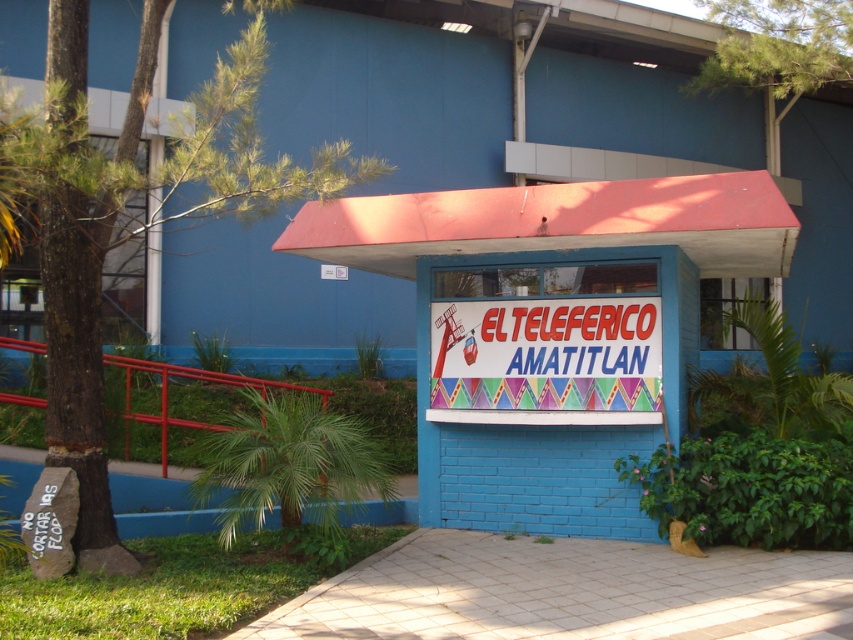
Question: Where is blue painted brick sign at center located in relation to colorful plastic sign at center in the image?

Choices:
 (A) below
 (B) above

Answer: (B)

Question: Which of the following is the closest to the observer?

Choices:
 (A) blue painted brick sign at center
 (B) colorful plastic sign at center

Answer: (A)

Question: Does blue painted brick sign at center appear under colorful plastic sign at center?

Choices:
 (A) no
 (B) yes

Answer: (A)

Question: Is blue painted brick sign at center closer to camera compared to colorful plastic sign at center?

Choices:
 (A) yes
 (B) no

Answer: (A)

Question: Among these points, which one is farthest from the camera?

Choices:
 (A) (647, 387)
 (B) (459, 416)

Answer: (B)

Question: Which object appears farthest from the camera in this image?

Choices:
 (A) colorful plastic sign at center
 (B) blue painted brick sign at center

Answer: (A)